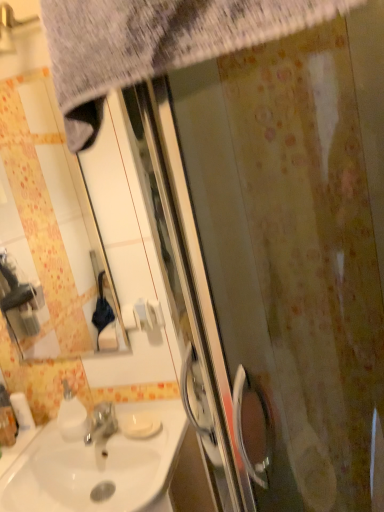
This screenshot has height=512, width=384. What are the coordinates of `textured gray towel at upper left` in the screenshot? It's located at (154, 42).

What do you see at coordinates (96, 467) in the screenshot? I see `white glossy sink at lower left` at bounding box center [96, 467].

At what (x,y) coordinates should I click in order to perform the action: click on white glossy soap dispenser at lower left. Please return your answer as a coordinate pair (x, y). The width and height of the screenshot is (384, 512). Looking at the image, I should click on (7, 420).

What do you see at coordinates (7, 420) in the screenshot?
I see `white glossy soap dispenser at lower left` at bounding box center [7, 420].

What do you see at coordinates (22, 411) in the screenshot? The height and width of the screenshot is (512, 384). I see `white matte toilet paper at lower left` at bounding box center [22, 411].

The height and width of the screenshot is (512, 384). What are the coordinates of `matte white mirror at upper left` in the screenshot? It's located at (48, 228).

From the image's perspective, who appears lower, white glossy soap dispenser at lower left or white glossy sink at lower left?

From the image's view, white glossy sink at lower left is below.

Is white glossy soap dispenser at lower left positioned with its back to white glossy sink at lower left?

No, white glossy soap dispenser at lower left's orientation is not away from white glossy sink at lower left.

From a real-world perspective, which object rests below the other?

white glossy sink at lower left is physically lower.

The width and height of the screenshot is (384, 512). Identify the location of bottle above the white glossy sink at lower left (from a real-world perspective). (7, 420).

Is matte white mirror at upper left bigger or smaller than white glossy soap dispenser at lower left?

In the image, matte white mirror at upper left appears to be larger than white glossy soap dispenser at lower left.

From a real-world perspective, who is located lower, matte white mirror at upper left or white glossy soap dispenser at lower left?

white glossy soap dispenser at lower left, from a real-world perspective.

Does matte white mirror at upper left appear on the left side of white glossy soap dispenser at lower left?

No, matte white mirror at upper left is not to the left of white glossy soap dispenser at lower left.

Can you confirm if matte white mirror at upper left is taller than white glossy soap dispenser at lower left?

Indeed, matte white mirror at upper left has a greater height compared to white glossy soap dispenser at lower left.

Is white glossy soap dispenser at lower left further to camera compared to matte white mirror at upper left?

That is True.

Is white glossy soap dispenser at lower left wider than matte white mirror at upper left?

Indeed, white glossy soap dispenser at lower left has a greater width compared to matte white mirror at upper left.

Is white glossy soap dispenser at lower left facing towards matte white mirror at upper left?

No, white glossy soap dispenser at lower left is not aimed at matte white mirror at upper left.

Does point (5, 413) come behind point (95, 295)?

That is False.

Does white glossy soap dispenser at lower left have a lesser width compared to textured gray towel at upper left?

Yes.

Is white glossy soap dispenser at lower left in contact with textured gray towel at upper left?

No.

From the image's perspective, which one is positioned lower, white glossy soap dispenser at lower left or textured gray towel at upper left?

white glossy soap dispenser at lower left is shown below in the image.

Is white glossy soap dispenser at lower left facing towards textured gray towel at upper left?

No, white glossy soap dispenser at lower left is not turned towards textured gray towel at upper left.

Is matte white mirror at upper left at the back of textured gray towel at upper left?

No, textured gray towel at upper left is not facing the opposite direction of matte white mirror at upper left.

Considering the relative sizes of textured gray towel at upper left and matte white mirror at upper left in the image provided, is textured gray towel at upper left shorter than matte white mirror at upper left?

Indeed, textured gray towel at upper left has a lesser height compared to matte white mirror at upper left.

Can you confirm if textured gray towel at upper left is positioned to the right of matte white mirror at upper left?

Correct, you'll find textured gray towel at upper left to the right of matte white mirror at upper left.

Between textured gray towel at upper left and white glossy sink at lower left, which one has more height?

With more height is white glossy sink at lower left.

From the image's perspective, between textured gray towel at upper left and white glossy sink at lower left, which one is located above?

textured gray towel at upper left appears higher in the image.

Image resolution: width=384 pixels, height=512 pixels. I want to click on sink on the left of textured gray towel at upper left, so click(x=96, y=467).

Does textured gray towel at upper left turn towards white glossy sink at lower left?

No, textured gray towel at upper left is not facing towards white glossy sink at lower left.

Is textured gray towel at upper left not within white glossy soap dispenser at lower left?

Indeed, textured gray towel at upper left is completely outside white glossy soap dispenser at lower left.

Who is smaller, textured gray towel at upper left or white glossy soap dispenser at lower left?

white glossy soap dispenser at lower left.

From the picture: From a real-world perspective, is textured gray towel at upper left above or below white glossy soap dispenser at lower left?

From a real-world perspective, textured gray towel at upper left is physically above white glossy soap dispenser at lower left.

Between textured gray towel at upper left and white glossy soap dispenser at lower left, which one appears on the left side from the viewer's perspective?

white glossy soap dispenser at lower left.

This screenshot has height=512, width=384. I want to click on bottle above the white glossy sink at lower left (from the image's perspective), so point(7,420).

This screenshot has width=384, height=512. Find the location of `mirror on the right of white glossy soap dispenser at lower left`. mirror on the right of white glossy soap dispenser at lower left is located at coordinates (48, 228).

Considering their positions, is white glossy sink at lower left positioned closer to matte white mirror at upper left than textured gray towel at upper left?

The object closer to matte white mirror at upper left is white glossy sink at lower left.

Estimate the real-world distances between objects in this image. Which object is closer to matte white mirror at upper left, white matte toilet paper at lower left or white glossy soap dispenser at lower left?

white glossy soap dispenser at lower left is closer to matte white mirror at upper left.

Estimate the real-world distances between objects in this image. Which object is further from white glossy sink at lower left, white matte toilet paper at lower left or white glossy soap dispenser at lower left?

white glossy soap dispenser at lower left is further to white glossy sink at lower left.

Considering their positions, is white glossy soap dispenser at lower left positioned closer to white matte toilet paper at lower left than white glossy sink at lower left?

white glossy soap dispenser at lower left.

Considering their positions, is textured gray towel at upper left positioned closer to white glossy soap dispenser at lower left than matte white mirror at upper left?

matte white mirror at upper left is closer to white glossy soap dispenser at lower left.

Considering their positions, is matte white mirror at upper left positioned closer to white matte toilet paper at lower left than white glossy soap dispenser at lower left?

white glossy soap dispenser at lower left is closer to white matte toilet paper at lower left.

Which object lies nearer to the anchor point textured gray towel at upper left, white glossy sink at lower left or matte white mirror at upper left?

Among the two, white glossy sink at lower left is located nearer to textured gray towel at upper left.

Estimate the real-world distances between objects in this image. Which object is further from white glossy soap dispenser at lower left, white matte toilet paper at lower left or textured gray towel at upper left?

Based on the image, textured gray towel at upper left appears to be further to white glossy soap dispenser at lower left.

Identify the location of mirror positioned between textured gray towel at upper left and white glossy soap dispenser at lower left from near to far. (48, 228).

Locate an element on the screen. This screenshot has width=384, height=512. bottle located between white glossy sink at lower left and white matte toilet paper at lower left in the depth direction is located at coordinates (7, 420).

At what (x,y) coordinates should I click in order to perform the action: click on sink located between textured gray towel at upper left and white glossy soap dispenser at lower left in the depth direction. Please return your answer as a coordinate pair (x, y). The height and width of the screenshot is (512, 384). Looking at the image, I should click on [96, 467].

You are a GUI agent. You are given a task and a screenshot of the screen. Output one action in this format:
    pyautogui.click(x=<x>, y=<y>)
    Task: Click on the bottle between matte white mirror at upper left and white glossy sink at lower left from top to bottom
    This screenshot has height=512, width=384.
    Given the screenshot: What is the action you would take?
    pyautogui.click(x=7, y=420)